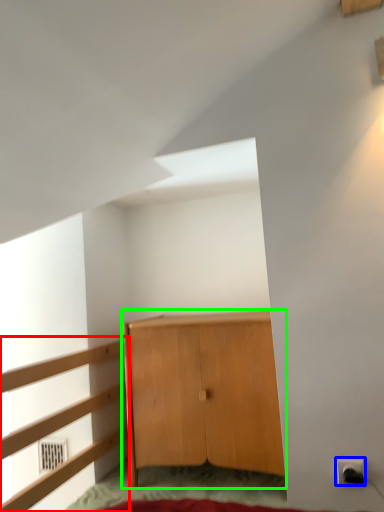
Question: Considering the real-world distances, which object is farthest from dresser (highlighted by a red box)? electric outlet (highlighted by a blue box) or cupboard (highlighted by a green box)?

Choices:
 (A) electric outlet
 (B) cupboard

Answer: (A)